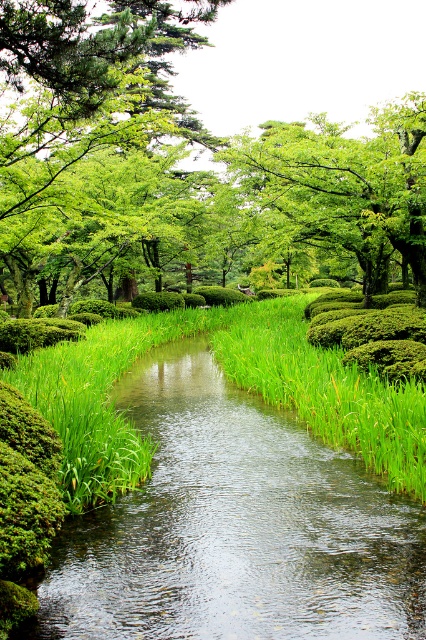
Does green grassy stream at center appear over green leafy tree at upper left?

No, green grassy stream at center is not above green leafy tree at upper left.

Is green grassy stream at center smaller than green leafy tree at upper left?

Yes, green grassy stream at center is smaller than green leafy tree at upper left.

Is point (144, 378) more distant than point (63, 52)?

That is True.

This screenshot has width=426, height=640. What are the coordinates of `green grassy stream at center` in the screenshot? It's located at (235, 528).

Which is below, green grassy stream at center or green leafy tree at upper center?

green grassy stream at center is lower down.

Between green grassy stream at center and green leafy tree at upper center, which one is positioned higher?

Positioned higher is green leafy tree at upper center.

The width and height of the screenshot is (426, 640). I want to click on green grassy stream at center, so click(x=235, y=528).

In the scene shown: Is green grassy stream at center taller than green leafy grass at center?

In fact, green grassy stream at center may be shorter than green leafy grass at center.

Can you confirm if green grassy stream at center is positioned to the right of green leafy grass at center?

Indeed, green grassy stream at center is positioned on the right side of green leafy grass at center.

Find the location of a particular element. Image resolution: width=426 pixels, height=640 pixels. green grassy stream at center is located at coordinates (235, 528).